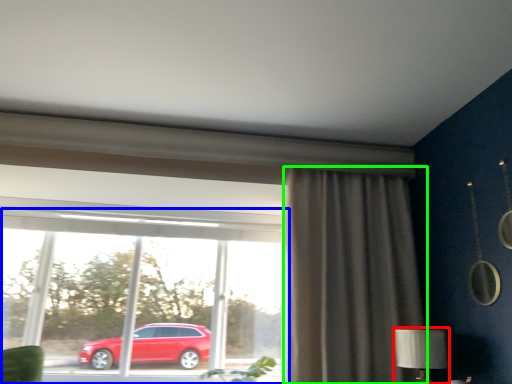
Question: Considering the real-world distances, which object is farthest from table lamp (highlighted by a red box)? window (highlighted by a blue box) or curtain (highlighted by a green box)?

Choices:
 (A) window
 (B) curtain

Answer: (A)